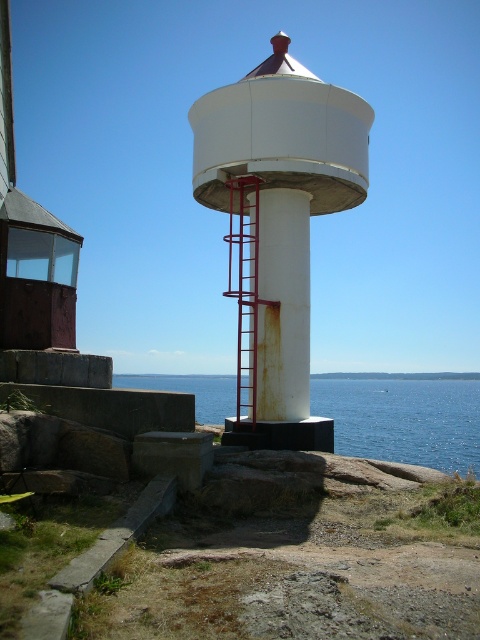
Question: Estimate the real-world distances between objects in this image. Which object is farther from the white matte water tower at center?

Choices:
 (A) blue water at center
 (B) rusty metal pillar at center
 (C) metallic red ladder at center

Answer: (A)

Question: Which point is closer to the camera?

Choices:
 (A) (276, 282)
 (B) (239, 385)

Answer: (B)

Question: Which object is farther from the camera taking this photo?

Choices:
 (A) metallic red ladder at center
 (B) rusty metal pillar at center
 (C) blue water at center
 (D) white matte water tower at center

Answer: (B)

Question: Can you confirm if white matte water tower at center is thinner than blue water at center?

Choices:
 (A) no
 (B) yes

Answer: (B)

Question: From the image, what is the correct spatial relationship of white matte water tower at center in relation to rusty metal pillar at center?

Choices:
 (A) left
 (B) right

Answer: (A)

Question: Is blue water at center to the right of metallic red ladder at center from the viewer's perspective?

Choices:
 (A) yes
 (B) no

Answer: (B)